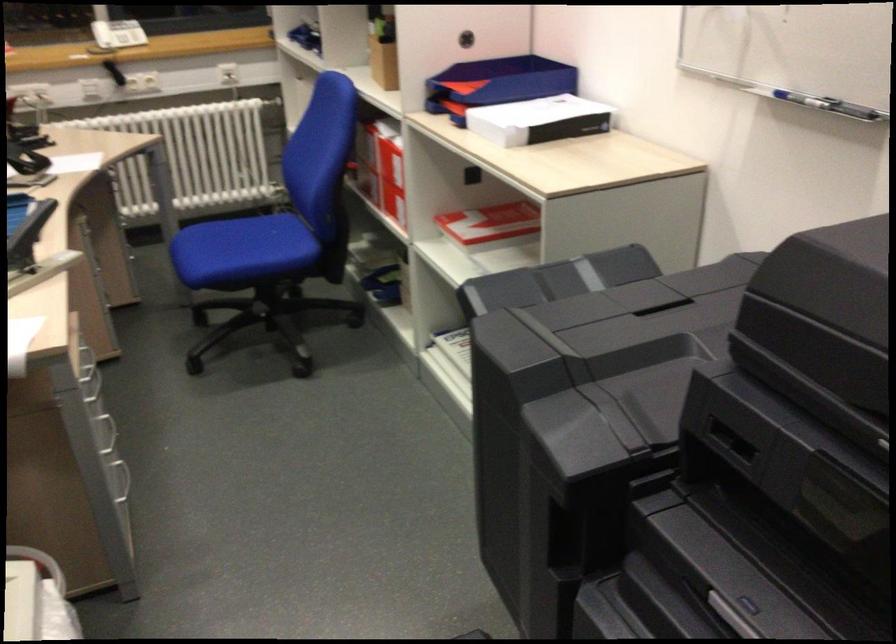
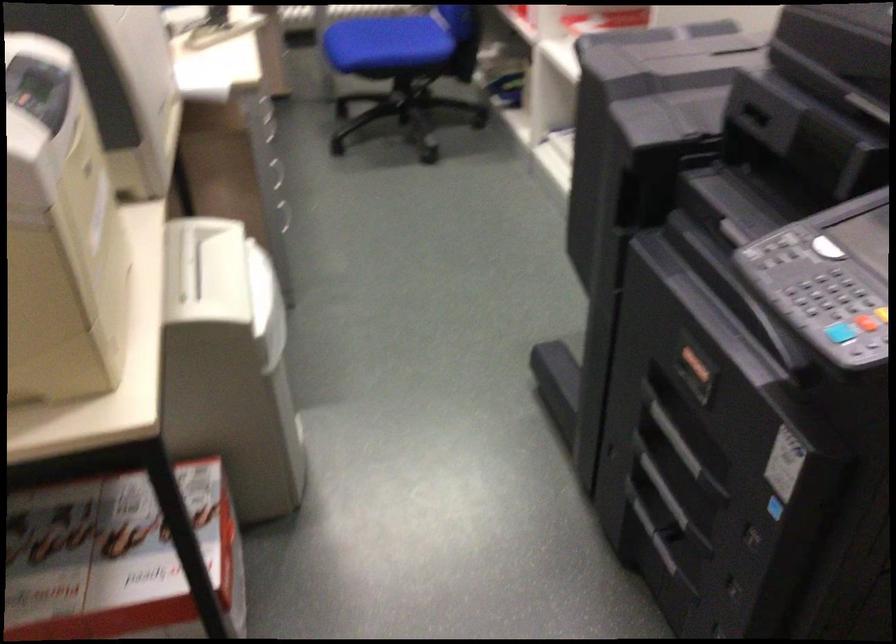
Question: Based on the continuous images, in which direction is the camera rotating? Reply with the corresponding letter.

Choices:
 (A) Left
 (B) Right
 (C) Up
 (D) Down

Answer: (D)